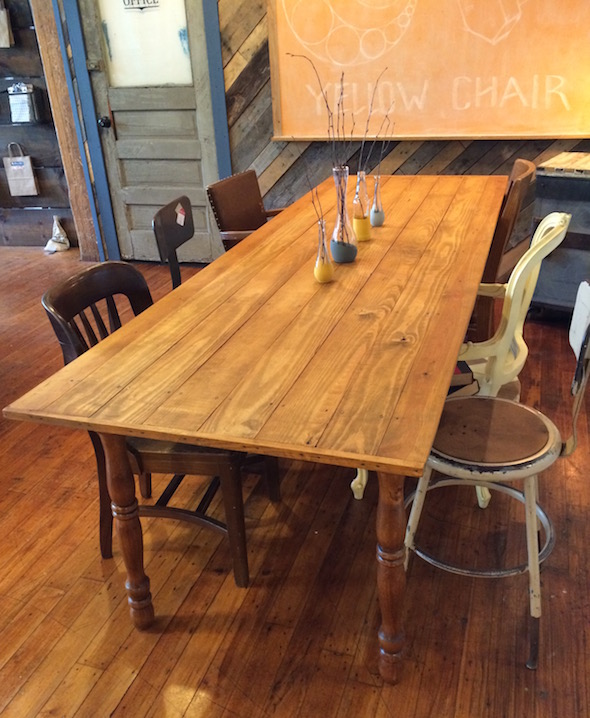
Where is `2 yellow sand center pieces`? 2 yellow sand center pieces is located at coordinates (362, 230), (321, 278).